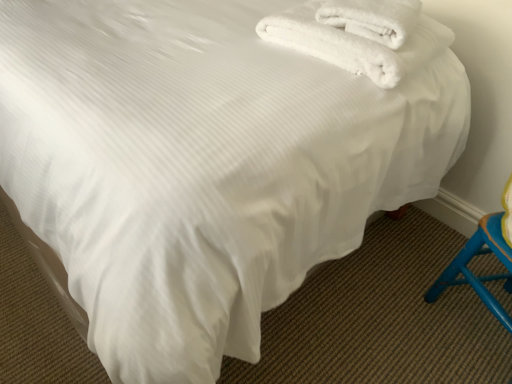
Identify the location of empty space that is ontop of white fluffy towel at upper right, which is the first towel in right-to-left order (from a real-world perspective). The width and height of the screenshot is (512, 384). (386, 3).